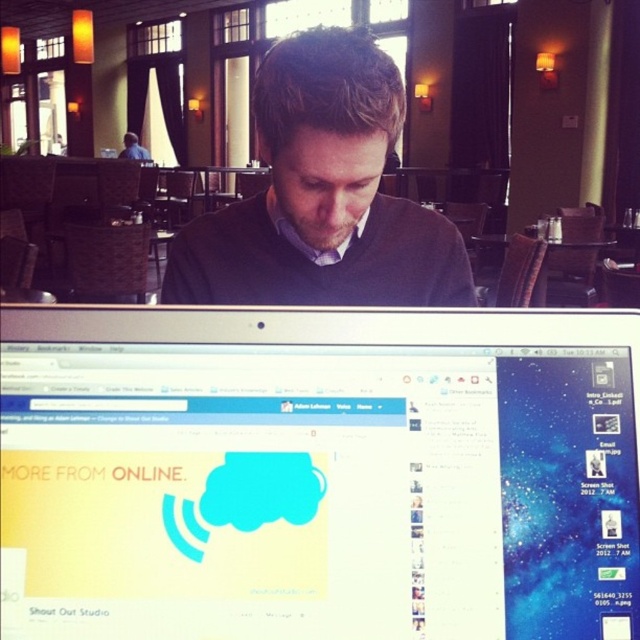
Question: Which of the following is the closest to the observer?

Choices:
 (A) (355, 61)
 (B) (147, 390)
 (C) (532, 289)
 (D) (124, 154)

Answer: (B)

Question: Is satin black monitor at center smaller than matte black sweater at center?

Choices:
 (A) yes
 (B) no

Answer: (A)

Question: Is satin black monitor at center below wooden table at center?

Choices:
 (A) yes
 (B) no

Answer: (A)

Question: Does dark gray sweater at center appear under wooden table at center?

Choices:
 (A) yes
 (B) no

Answer: (A)

Question: Which of the following is the closest to the observer?

Choices:
 (A) satin black monitor at center
 (B) wooden table at center
 (C) dark gray sweater at center
 (D) matte black sweater at center

Answer: (A)

Question: Which of the following is the closest to the observer?

Choices:
 (A) wooden table at center
 (B) satin black monitor at center

Answer: (B)